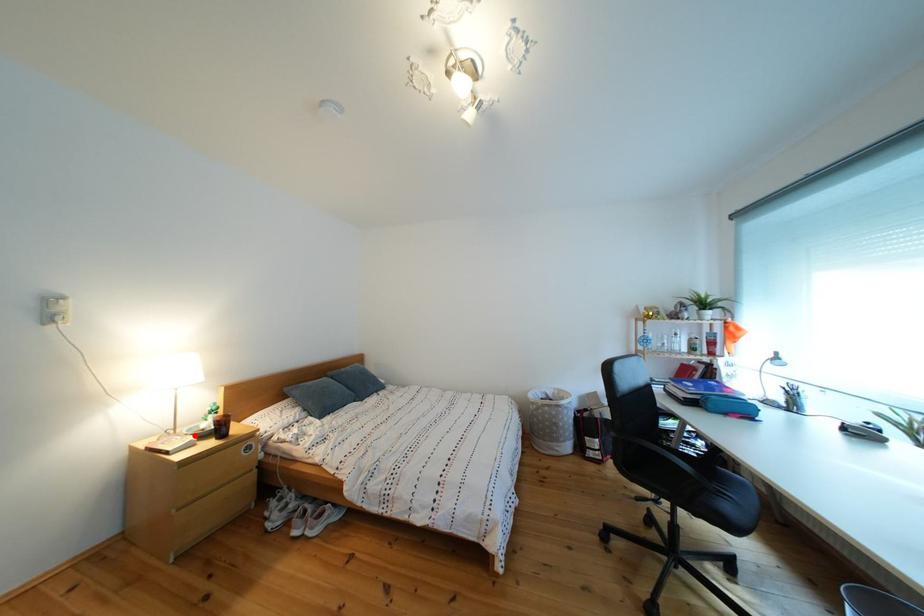
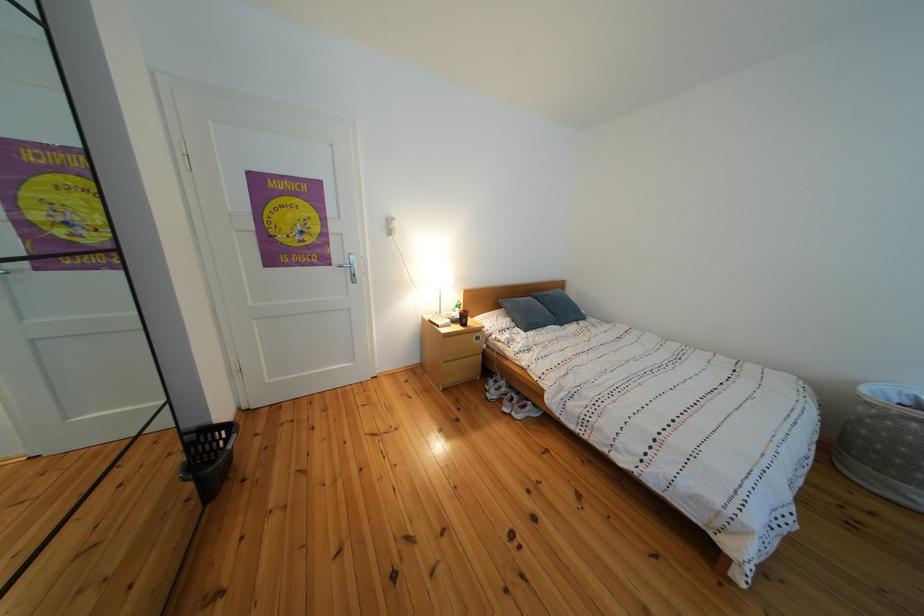
The point at the highlighted location is marked in the first image. Where is the corresponding point in the second image?

(456, 320)